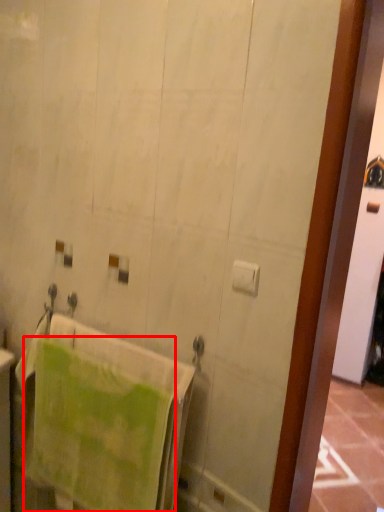
Question: From the image's perspective, where is towel (annotated by the red box) located relative to toilet paper?

Choices:
 (A) below
 (B) above

Answer: (A)